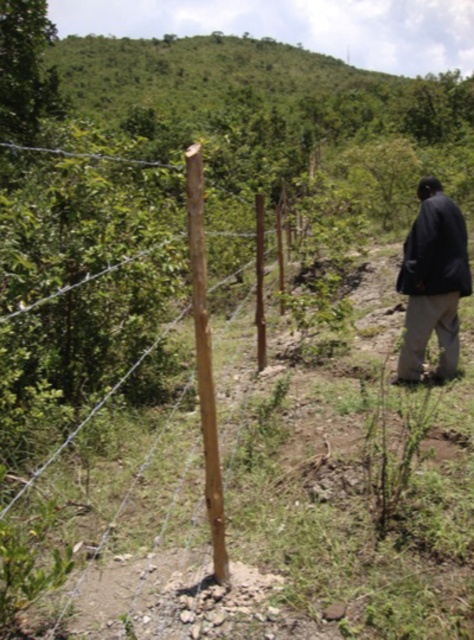
Question: Does brown rough wood post at center appear over dark blue jacket at lower right?

Choices:
 (A) no
 (B) yes

Answer: (B)

Question: Considering the relative positions of brown rough wood post at center and dark blue jacket at lower right in the image provided, where is brown rough wood post at center located with respect to dark blue jacket at lower right?

Choices:
 (A) above
 (B) below

Answer: (A)

Question: Does brown rough wood post at center appear over dark blue jacket at lower right?

Choices:
 (A) no
 (B) yes

Answer: (B)

Question: Among these points, which one is nearest to the camera?

Choices:
 (A) (446, 252)
 (B) (188, 385)

Answer: (A)

Question: Which object appears closest to the camera in this image?

Choices:
 (A) brown rough wood post at center
 (B) dark blue jacket at lower right

Answer: (A)